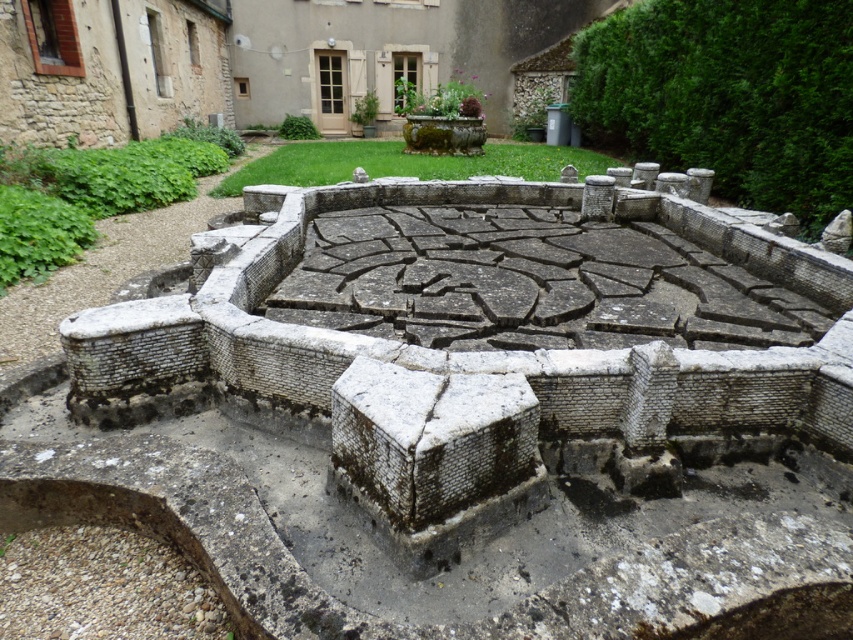
Can you confirm if green leafy plant at left is positioned to the left of rough stone fountain at center?

Yes, green leafy plant at left is to the left of rough stone fountain at center.

Identify the location of green leafy plant at left. (94, 192).

Between gray stone maze at center and green leafy plant at left, which one has more height?

With more height is green leafy plant at left.

Between gray stone maze at center and green leafy plant at left, which one appears on the left side from the viewer's perspective?

green leafy plant at left is more to the left.

Where is `gray stone maze at center`? The width and height of the screenshot is (853, 640). gray stone maze at center is located at coordinates (462, 420).

Where is `gray stone maze at center`? Image resolution: width=853 pixels, height=640 pixels. gray stone maze at center is located at coordinates (462, 420).

Does gray stone maze at center have a larger size compared to gray stone wall at upper right?

No.

Can you confirm if gray stone maze at center is smaller than gray stone wall at upper right?

Correct, gray stone maze at center occupies less space than gray stone wall at upper right.

Where is `gray stone maze at center`? The width and height of the screenshot is (853, 640). gray stone maze at center is located at coordinates (462, 420).

Where is `gray stone maze at center`? Image resolution: width=853 pixels, height=640 pixels. gray stone maze at center is located at coordinates (462, 420).